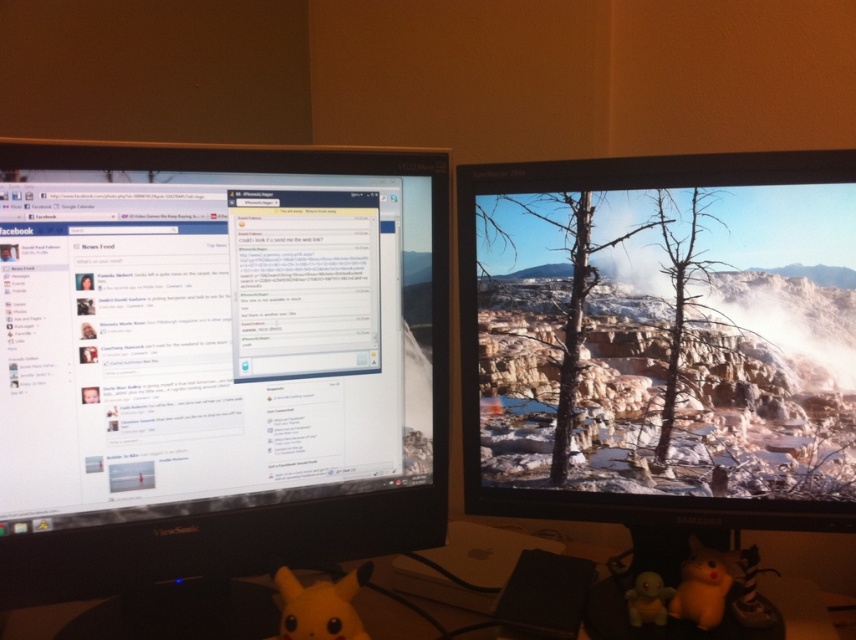
You are a user looking at the two monitors. There is a yellow plush toy at lower right. Where exactly is the yellow plush toy located in relation to the monitors?

The yellow plush toy at lower right is located at point coordinates of (703,584).

You are a technician who needs to locate the black glossy monitor at left on a desk with two monitors. Based on the coordinates provided, where should you look to find it?

The black glossy monitor at left is located at coordinates point (x=217, y=360).

Consider the image. You have a small toy that is 30 centimeters long. You want to place it between the matte yellow plush at lower center and the matte yellow rubber duck at lower right on the desk. Will it fit without overlapping either of them?

The distance between the matte yellow plush at lower center and the matte yellow rubber duck at lower right is 29.83 centimeters. Since the toy is 30 centimeters long, it will not fit between them without overlapping as it is slightly longer than the available space.